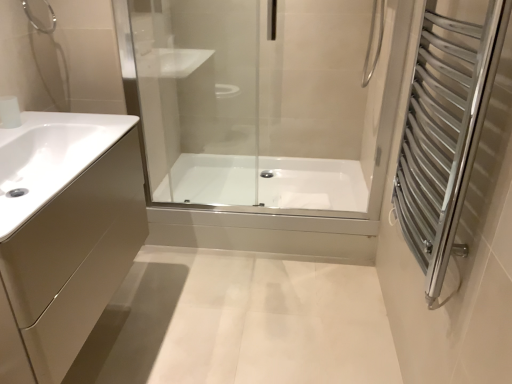
In order to face brushed metal shower at upper left, should I rotate leftwards or rightwards?

You should rotate left by 27.032 degrees.

Image resolution: width=512 pixels, height=384 pixels. I want to click on brushed metal shower at upper left, so click(34, 22).

What is the approximate width of silver metallic towel rack at right?

It is 3.82 inches.

Measure the distance between point (x=211, y=176) and camera.

Point (x=211, y=176) is 8.64 feet from camera.

Locate an element on the screen. transparent glass shower door at center is located at coordinates (265, 120).

Locate an element on the screen. This screenshot has height=384, width=512. brushed metal shower at upper left is located at coordinates (34, 22).

Does silver metallic towel rack at right touch white glossy faucet at upper left?

No, silver metallic towel rack at right is not next to white glossy faucet at upper left.

In terms of width, does silver metallic towel rack at right look wider or thinner when compared to white glossy faucet at upper left?

In the image, silver metallic towel rack at right appears to be wider than white glossy faucet at upper left.

Can you confirm if silver metallic towel rack at right is shorter than white glossy faucet at upper left?

In fact, silver metallic towel rack at right may be taller than white glossy faucet at upper left.

From the picture: Is white glossy faucet at upper left a part of silver metallic towel rack at right?

Actually, white glossy faucet at upper left is outside silver metallic towel rack at right.

From a real-world perspective, between white glossy bathtub at center and white glossy sink at left, who is vertically lower?

white glossy bathtub at center is physically lower.

From the image's perspective, is white glossy bathtub at center above or below white glossy sink at left?

white glossy bathtub at center is situated lower than white glossy sink at left in the image.

Looking at this image, are white glossy bathtub at center and white glossy sink at left beside each other?

No, white glossy bathtub at center is not in contact with white glossy sink at left.

Considering the relative positions of white glossy bathtub at center and white glossy sink at left in the image provided, is white glossy bathtub at center to the left of white glossy sink at left from the viewer's perspective?

Incorrect, white glossy bathtub at center is not on the left side of white glossy sink at left.

Between point (423, 26) and point (49, 29), which one is positioned behind?

The point (49, 29) is more distant.

Looking at this image, from the image's perspective, is silver metallic towel rack at right located above or below brushed metal shower at upper left?

Based on their image positions, silver metallic towel rack at right is located beneath brushed metal shower at upper left.

Does silver metallic towel rack at right appear on the right side of brushed metal shower at upper left?

Yes.

Consider the image. From a real-world perspective, which is physically below, white glossy faucet at upper left or white glossy sink at left?

In real-world perspective, white glossy sink at left is lower.

Which is in front, point (8, 123) or point (62, 151)?

The point (62, 151) is in front.

Locate an element on the screen. faucet positioned vertically above the white glossy sink at left (from a real-world perspective) is located at coordinates (9, 112).

Consider the image. Between white glossy faucet at upper left and white glossy sink at left, which one is positioned behind?

white glossy faucet at upper left is further from the camera.

Considering the relative sizes of transparent glass shower door at center and brushed metal shower at upper left in the image provided, is transparent glass shower door at center smaller than brushed metal shower at upper left?

No.

Does transparent glass shower door at center appear on the right side of brushed metal shower at upper left?

Yes.

Locate an element on the screen. This screenshot has height=384, width=512. shower door that appears below the brushed metal shower at upper left (from the image's perspective) is located at coordinates (265, 120).

Could you tell me if matte beige cabinet at left is turned towards brushed metal shower at upper left?

No, matte beige cabinet at left does not turn towards brushed metal shower at upper left.

How far apart are matte beige cabinet at left and brushed metal shower at upper left?

The distance of matte beige cabinet at left from brushed metal shower at upper left is 34.40 inches.

Is brushed metal shower at upper left completely or partially inside matte beige cabinet at left?

No, brushed metal shower at upper left is not surrounded by matte beige cabinet at left.

From a real-world perspective, who is located lower, white glossy bathtub at center or transparent glass shower door at center?

white glossy bathtub at center is physically lower.

Which of these two, white glossy bathtub at center or transparent glass shower door at center, is smaller?

transparent glass shower door at center is smaller.

This screenshot has height=384, width=512. I want to click on bath located on the right of transparent glass shower door at center, so click(266, 182).

Does point (273, 180) come behind point (326, 59)?

Yes.

I want to click on screen door in front of the white glossy faucet at upper left, so (x=445, y=129).

Identify the location of bath beneath the white glossy sink at left (from a real-world perspective). The height and width of the screenshot is (384, 512). (266, 182).

Considering their positions, is matte beige cabinet at left positioned further to silver metallic towel rack at right than brushed metal shower at upper left?

brushed metal shower at upper left lies further to silver metallic towel rack at right than the other object.

Considering their positions, is matte beige cabinet at left positioned closer to white glossy bathtub at center than silver metallic towel rack at right?

The object closer to white glossy bathtub at center is matte beige cabinet at left.

Considering their positions, is white glossy bathtub at center positioned closer to white glossy faucet at upper left than silver metallic towel rack at right?

silver metallic towel rack at right lies closer to white glossy faucet at upper left than the other object.

Which object lies further to the anchor point white glossy sink at left, white glossy faucet at upper left or silver metallic towel rack at right?

Based on the image, silver metallic towel rack at right appears to be further to white glossy sink at left.

Considering their positions, is white glossy faucet at upper left positioned closer to matte beige cabinet at left than white glossy sink at left?

white glossy sink at left.

From the image, which object appears to be nearer to white glossy faucet at upper left, white glossy sink at left or silver metallic towel rack at right?

white glossy sink at left.

Looking at this image, from the image, which object appears to be farther from white glossy faucet at upper left, brushed metal shower at upper left or silver metallic towel rack at right?

Based on the image, silver metallic towel rack at right appears to be further to white glossy faucet at upper left.

From the image, which object appears to be farther from white glossy bathtub at center, white glossy sink at left or silver metallic towel rack at right?

silver metallic towel rack at right is further to white glossy bathtub at center.

The image size is (512, 384). Identify the location of shower located between matte beige cabinet at left and white glossy bathtub at center in the depth direction. (34, 22).

In order to click on sink between brushed metal shower at upper left and transparent glass shower door at center in this screenshot , I will do `click(50, 158)`.

What are the coordinates of `shower door between white glossy sink at left and white glossy bathtub at center from front to back` in the screenshot? It's located at (265, 120).

Identify the location of shower door located between silver metallic towel rack at right and white glossy bathtub at center in the depth direction. This screenshot has height=384, width=512. (265, 120).